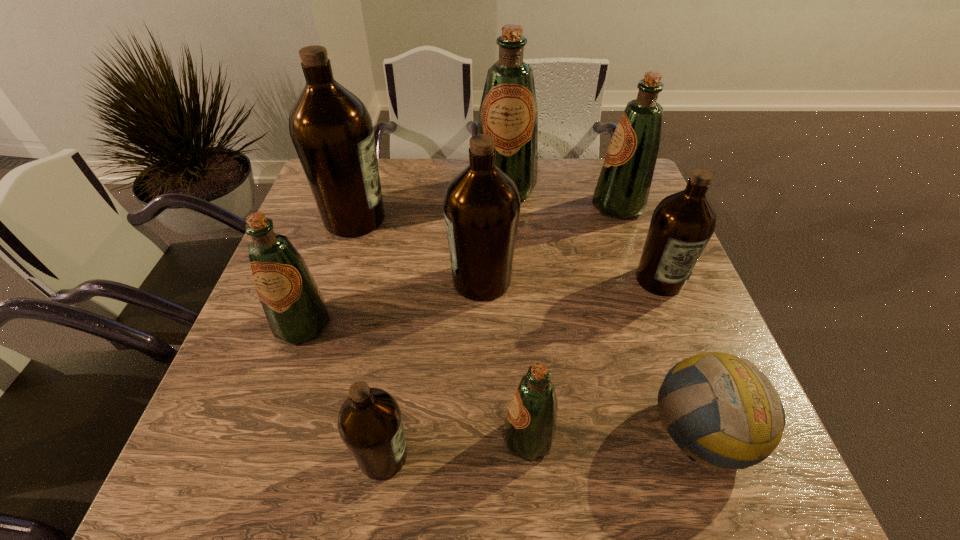
Find the location of a particular element. This screenshot has height=540, width=960. vacant area situated on the label of the second smallest brown olive oil is located at coordinates (682, 338).

Locate an element on the screen. vacant position located on the front-facing side of the second smallest green olive oil is located at coordinates (245, 493).

The image size is (960, 540). I want to click on vacant space situated on the front-facing side of the nearest green olive oil, so click(x=380, y=438).

Where is `vacant region located on the front-facing side of the nearest green olive oil`? The width and height of the screenshot is (960, 540). vacant region located on the front-facing side of the nearest green olive oil is located at coordinates (342, 438).

What are the coordinates of `vacant space positioned 0.350m on the front-facing side of the nearest green olive oil` in the screenshot? It's located at (308, 438).

Where is `free space located on the label of the sixth olive oil from right to left`? The image size is (960, 540). free space located on the label of the sixth olive oil from right to left is located at coordinates (468, 456).

Identify the location of vacant point located 0.110m on the back of the volleyball. (669, 340).

The height and width of the screenshot is (540, 960). Identify the location of volleyball located at the near edge. (742, 419).

Locate an element on the screen. This screenshot has height=540, width=960. volleyball at the right edge is located at coordinates (742, 419).

The height and width of the screenshot is (540, 960). What are the coordinates of `object that is at the far left corner` in the screenshot? It's located at (331, 129).